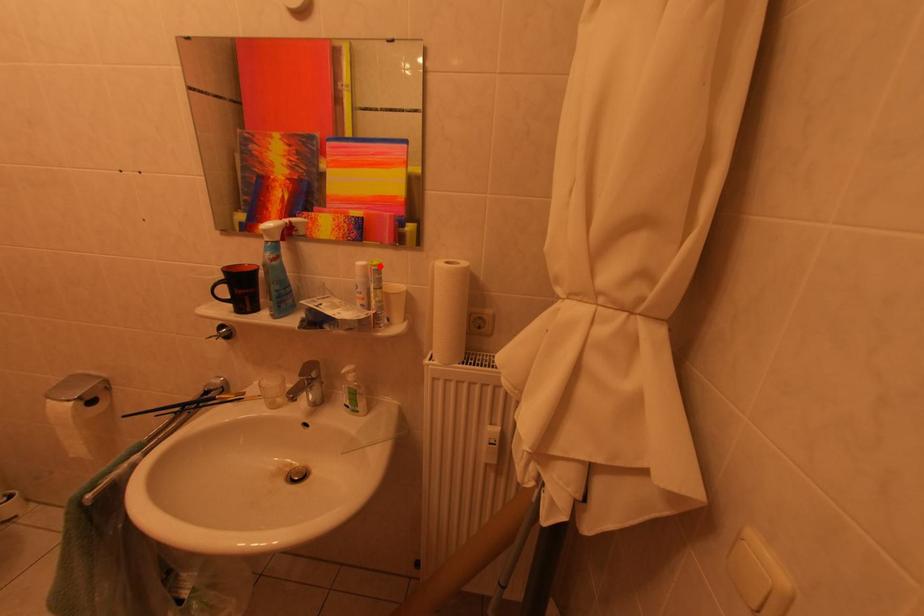
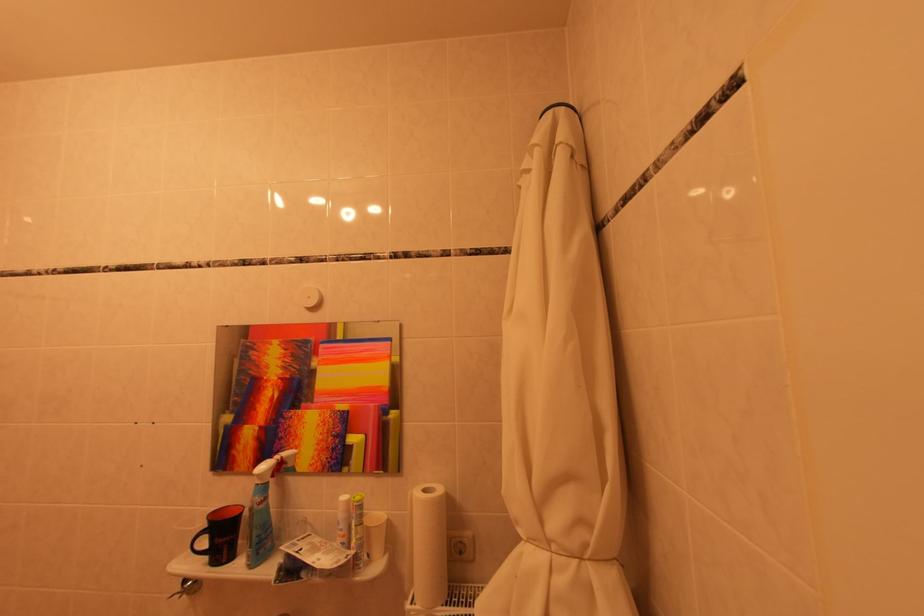
Question: I am providing you with two images of the same scene from different viewpoints. A red point is marked on the first image. Is the red point's position out of view in image 2?

Choices:
 (A) Yes
 (B) No

Answer: (B)